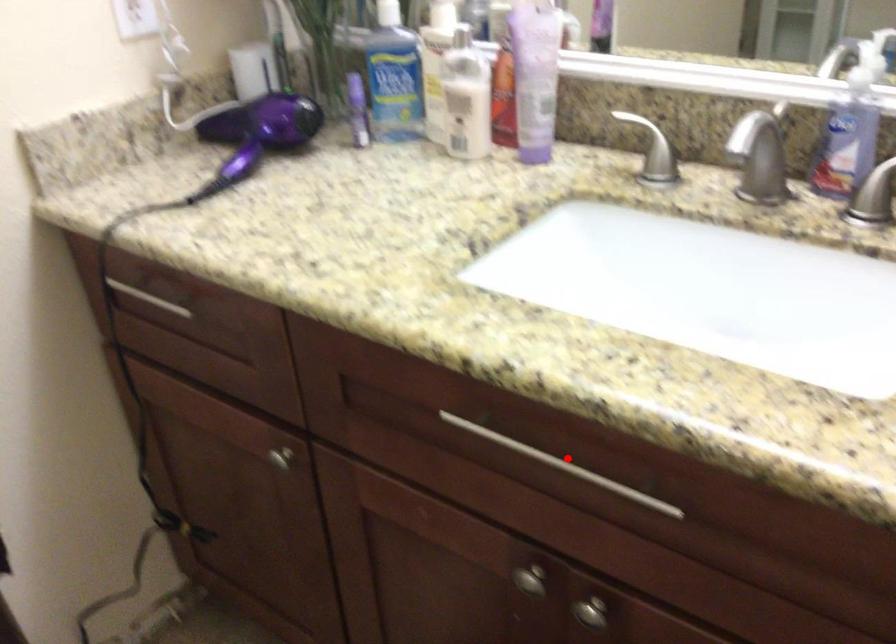
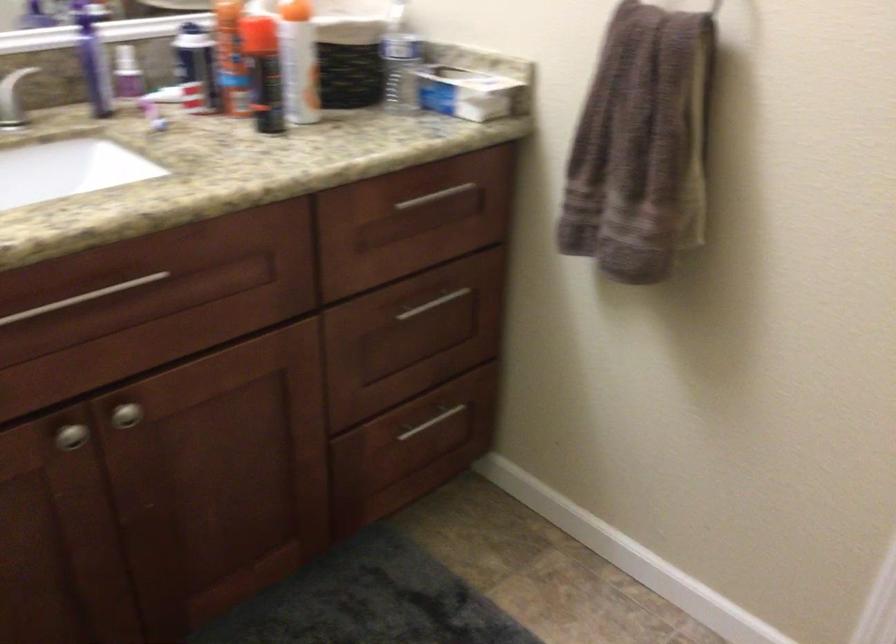
Find the pixel in the second image that matches the highlighted location in the first image.

(82, 298)